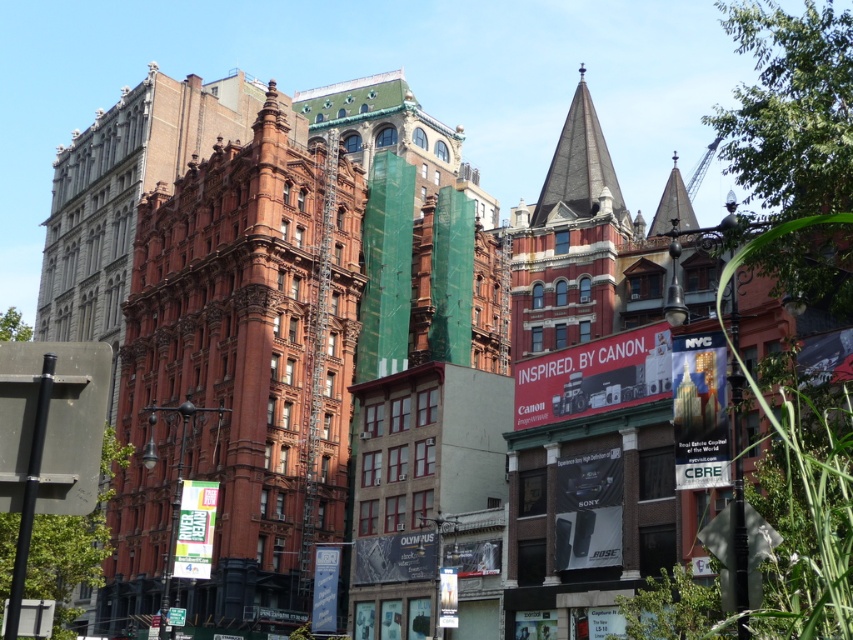
Can you confirm if red brick building at center is positioned to the right of dark gray slate spire at upper center?

In fact, red brick building at center is to the left of dark gray slate spire at upper center.

Is point (126, 570) behind point (607, 152)?

Yes, it is behind point (607, 152).

Image resolution: width=853 pixels, height=640 pixels. What are the coordinates of `red brick building at center` in the screenshot? It's located at (239, 376).